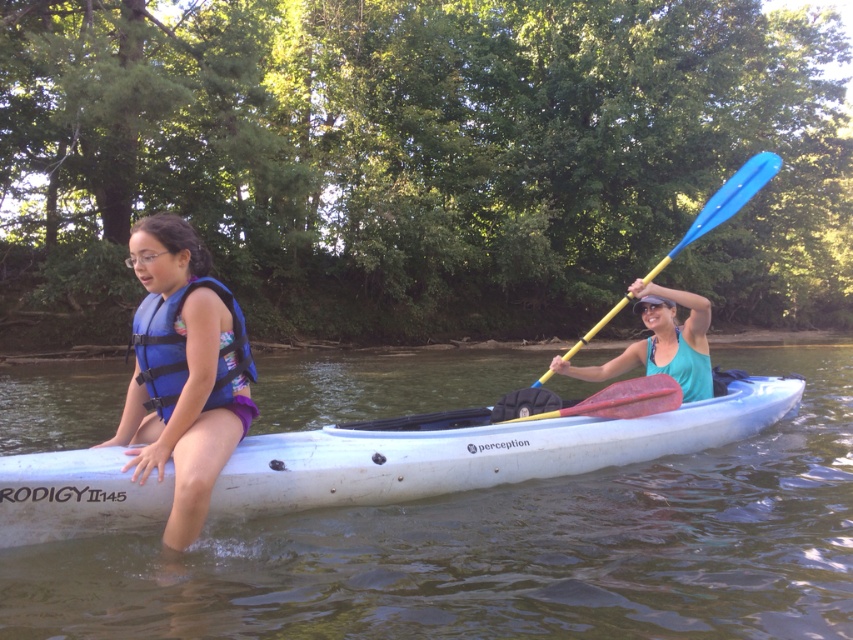
Question: Based on their relative distances, which object is nearer to the blue fabric life jacket at left?

Choices:
 (A) blue plastic paddle at upper right
 (B) teal fabric kayak paddle at center
 (C) red rubber paddle at center
 (D) white plastic canoe at center

Answer: (C)

Question: Which point appears closest to the camera in this image?

Choices:
 (A) (699, 346)
 (B) (402, 419)

Answer: (B)

Question: Which of the following is the closest to the observer?

Choices:
 (A) (161, 378)
 (B) (683, 369)
 (C) (569, 401)
 (D) (572, 352)

Answer: (A)

Question: Can you confirm if blue fabric life jacket at left is bigger than red rubber paddle at center?

Choices:
 (A) yes
 (B) no

Answer: (B)

Question: Is blue life vest at left thinner than teal fabric kayak paddle at center?

Choices:
 (A) yes
 (B) no

Answer: (A)

Question: Can you confirm if white plastic canoe at center is positioned above teal fabric kayak paddle at center?

Choices:
 (A) yes
 (B) no

Answer: (B)